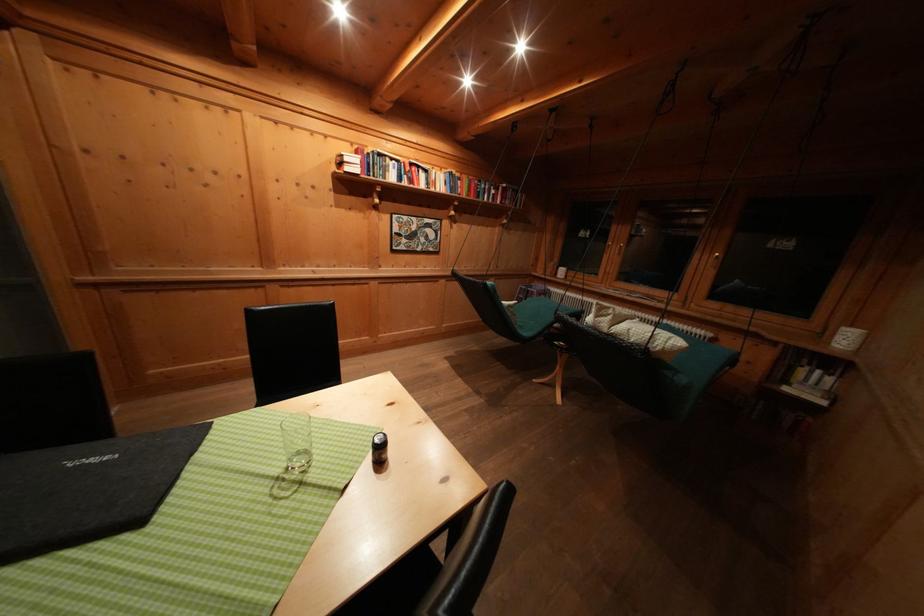
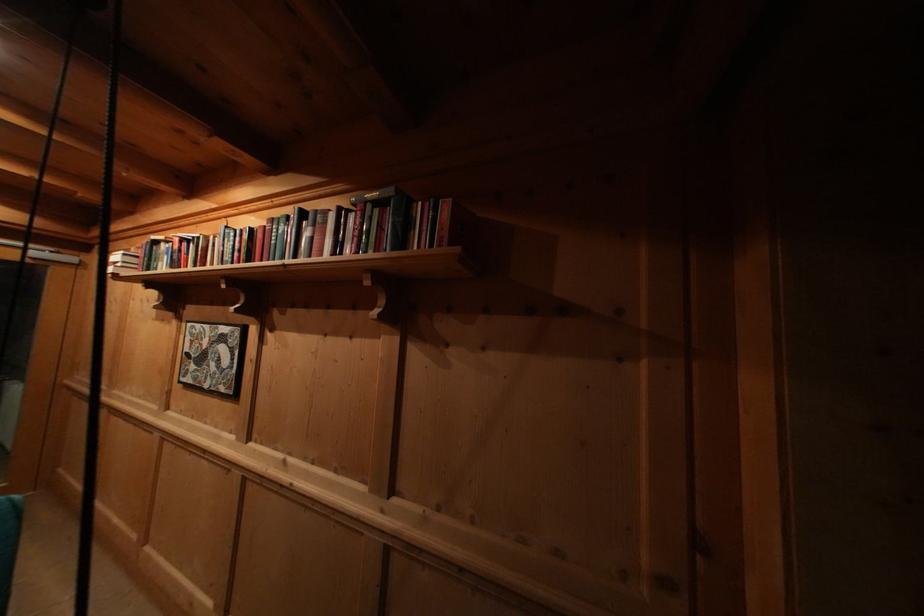
Where in the second image is the point corresponding to (411,223) from the first image?

(204, 331)